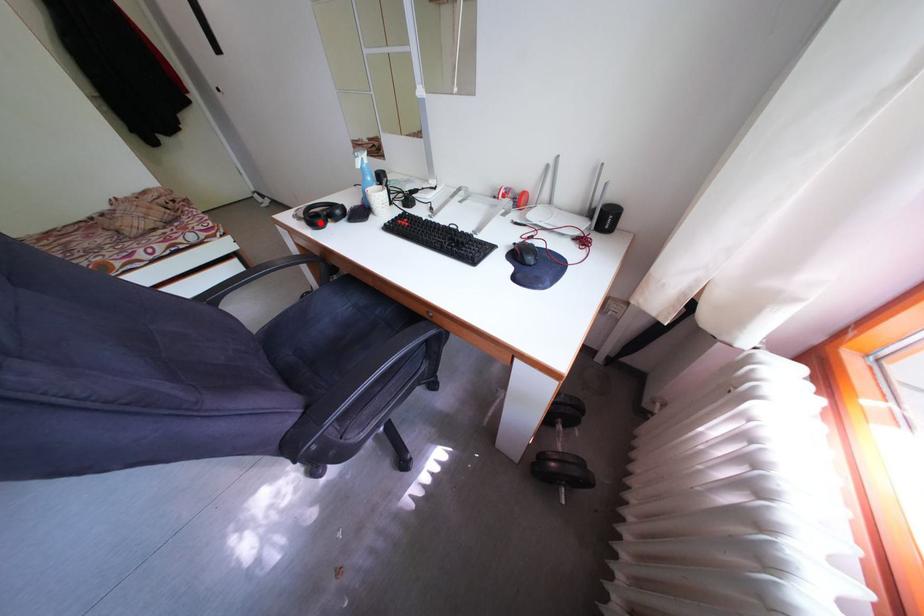
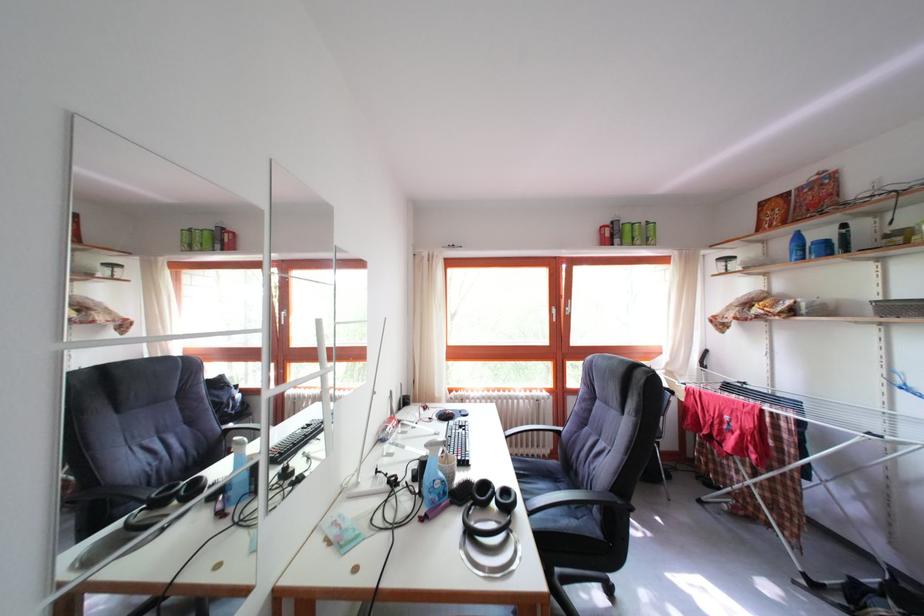
Find the pixel in the second image that matches the highlighted location in the first image.

(517, 506)